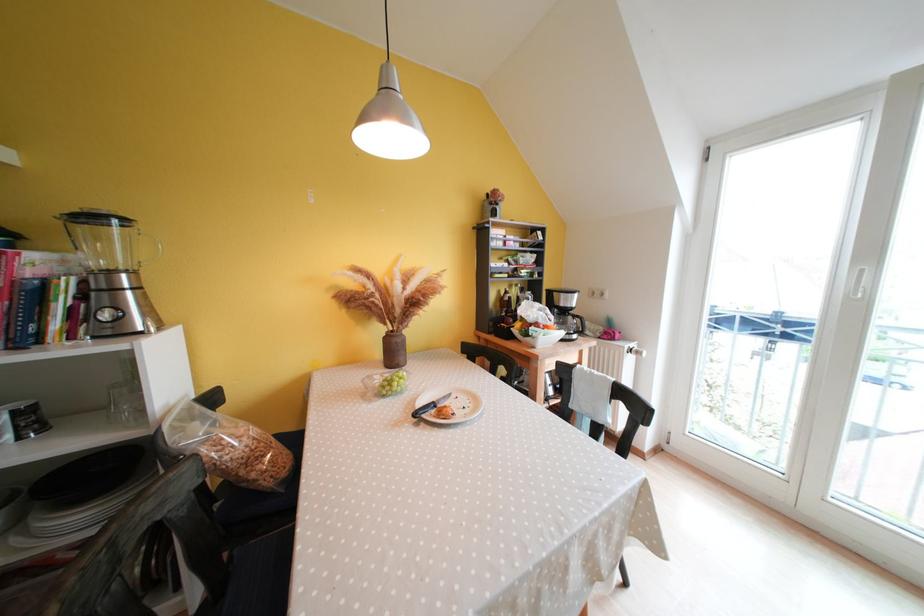
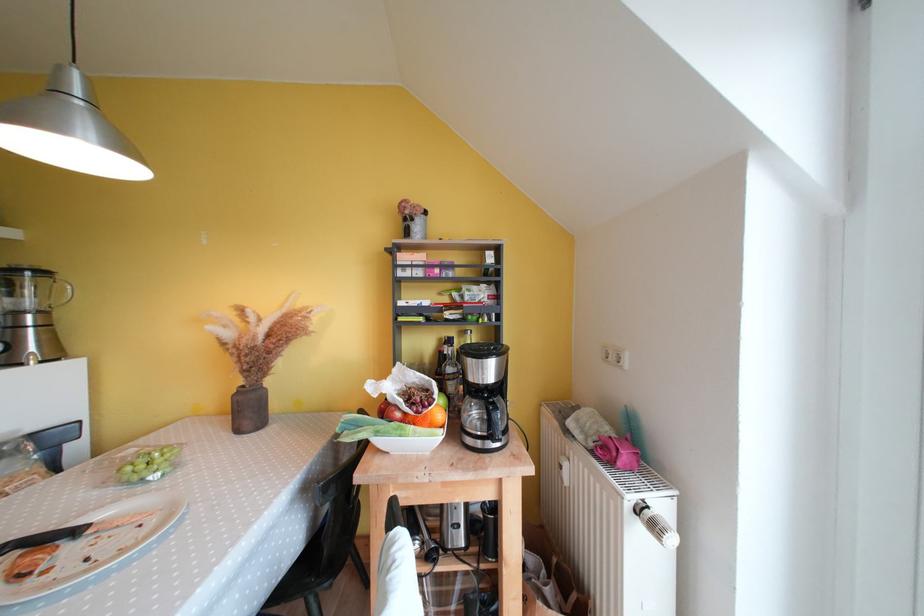
Find the pixel in the second image that matches (399,357) in the first image.

(256, 416)